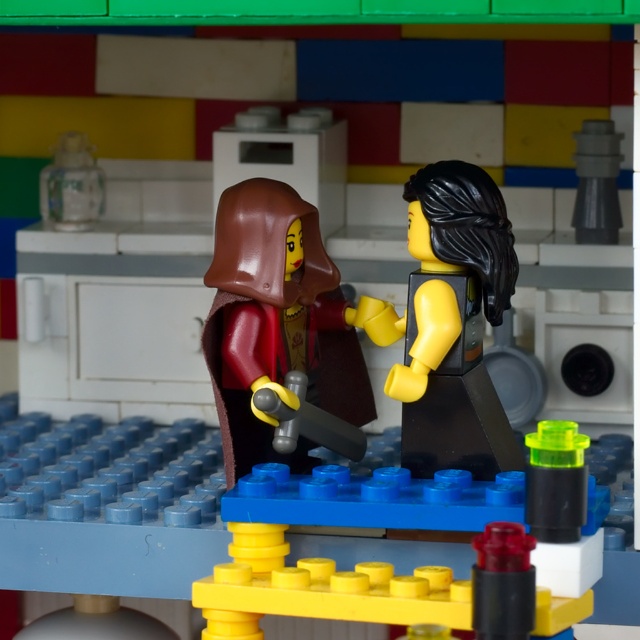
You are a LEGO builder trying to fit a new accessory between the smooth brown cape at center and the smooth black minifigure at center. The accessory requires 2 units of space. Can you fit it there?

The smooth brown cape at center is wider than the smooth black minifigure at center. Since the accessory requires 2 units of space, it depends on the available space between them. However, the description only provides information about their widths, not the distance between them. Without knowing the distance, it is impossible to determine if the accessory can fit.

You are a LEGO builder who needs to place a new LEGO piece that is 3 inches wide between the smooth brown cape at center and the smooth black minifigure at center. Can you fit it without overlapping either object?

The distance between the smooth brown cape at center and the smooth black minifigure at center is 4.01 inches. Since the new LEGO piece is 3 inches wide, there is enough space to place it between them without overlapping either object.

Where is the smooth brown cape at center located in the image?

The smooth brown cape at center is located at point (276,323).